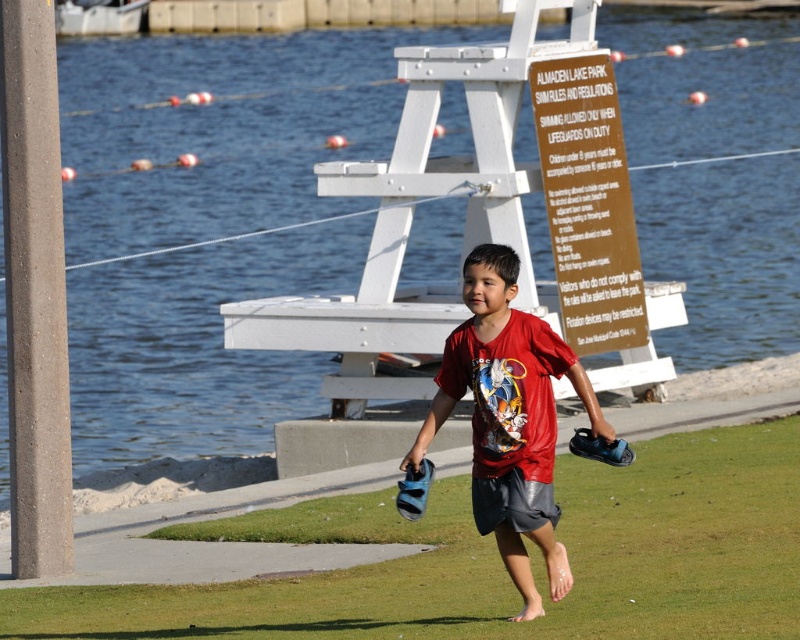
Question: Does green grass at center come behind brown wooden sign at upper center?

Choices:
 (A) no
 (B) yes

Answer: (A)

Question: Among these points, which one is farthest from the camera?

Choices:
 (A) (588, 276)
 (B) (680, 438)
 (C) (476, 515)
 (D) (442, 422)

Answer: (A)

Question: Is red matte shirt at center further to the viewer compared to dark gray cotton shorts at center?

Choices:
 (A) no
 (B) yes

Answer: (A)

Question: In this image, where is red matte shirt at center located relative to brown wooden sign at upper center?

Choices:
 (A) right
 (B) left

Answer: (B)

Question: Which object is closer to the camera taking this photo?

Choices:
 (A) red matte shirt at center
 (B) green grass at center
 (C) dark gray cotton shorts at center
 (D) brown wooden sign at upper center

Answer: (A)

Question: Which point appears closest to the camera in this image?

Choices:
 (A) (640, 620)
 (B) (508, 506)
 (C) (596, 221)
 (D) (522, 317)

Answer: (A)